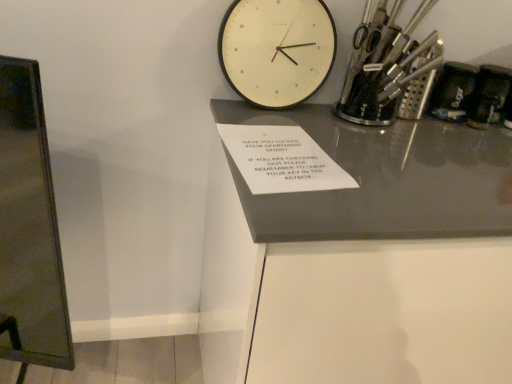
Question: From the image's perspective, is white glossy table at center located above or below metallic silver utensils at upper right, the 1th stationery viewed from the left?

Choices:
 (A) above
 (B) below

Answer: (B)

Question: Is white glossy table at center taller or shorter than metallic silver utensils at upper right, the 1th stationery viewed from the left?

Choices:
 (A) short
 (B) tall

Answer: (B)

Question: Based on their relative distances, which object is farther from the white glossy table at center?

Choices:
 (A) white matte wall clock at upper center
 (B) black plastic phone at upper right, the 1th stationery viewed from the right
 (C) metallic silver utensils at upper right, which is the 2th stationery from right to left

Answer: (B)

Question: Which is farther from the black plastic phone at upper right, the 2th stationery in the left-to-right sequence?

Choices:
 (A) metallic silver utensils at upper right, the 1th stationery viewed from the left
 (B) white matte wall clock at upper center
 (C) white glossy table at center

Answer: (C)